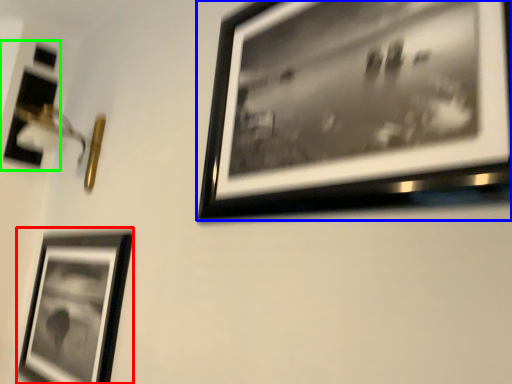
Question: Which object is positioned farthest from picture frame (highlighted by a red box)? Select from picture frame (highlighted by a blue box) and picture frame (highlighted by a green box).

Choices:
 (A) picture frame
 (B) picture frame

Answer: (B)